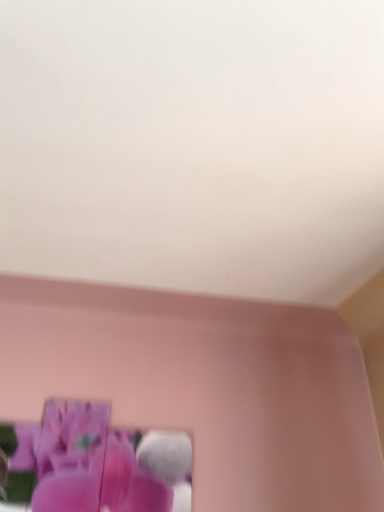
The width and height of the screenshot is (384, 512). What do you see at coordinates (91, 463) in the screenshot?
I see `matte pink flower at lower left` at bounding box center [91, 463].

Find the location of a particular element. matte pink flower at lower left is located at coordinates (91, 463).

I want to click on matte pink flower at lower left, so click(91, 463).